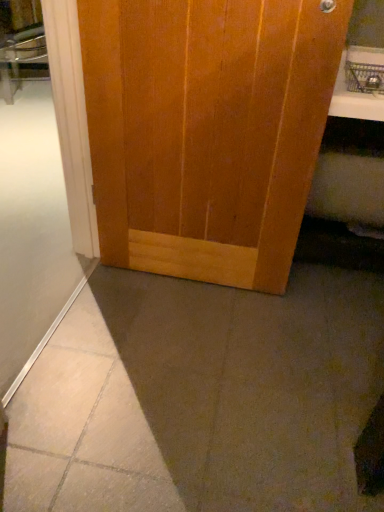
Question: Based on their positions, is white glossy counter top at upper right located to the left or right of white frosted glass at lower left?

Choices:
 (A) left
 (B) right

Answer: (B)

Question: In terms of width, does white glossy counter top at upper right look wider or thinner when compared to white frosted glass at lower left?

Choices:
 (A) thin
 (B) wide

Answer: (B)

Question: Which is farther from the wooden door at center?

Choices:
 (A) white frosted glass at lower left
 (B) white glossy counter top at upper right

Answer: (B)

Question: Which of these objects is positioned farthest from the white glossy counter top at upper right?

Choices:
 (A) white frosted glass at lower left
 (B) wooden door at center

Answer: (A)